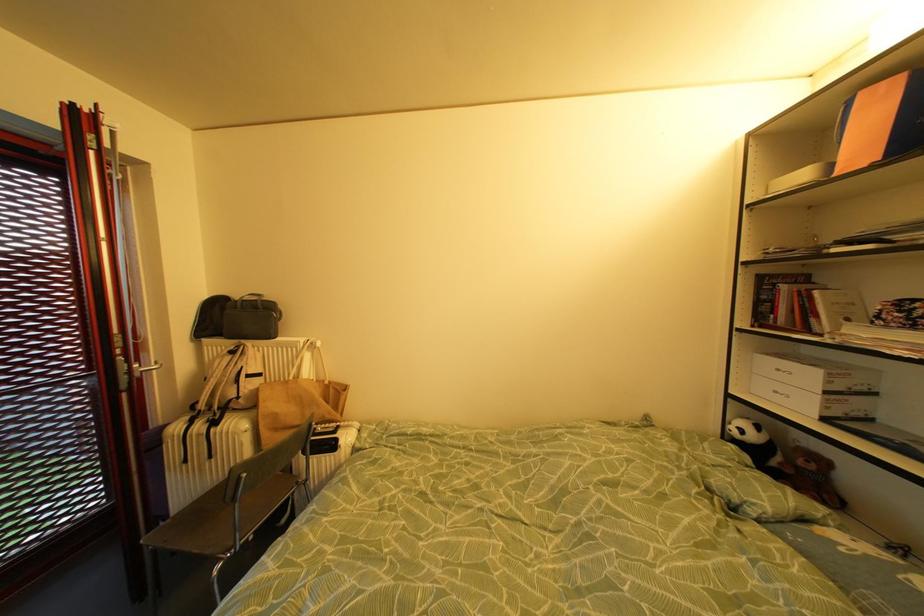
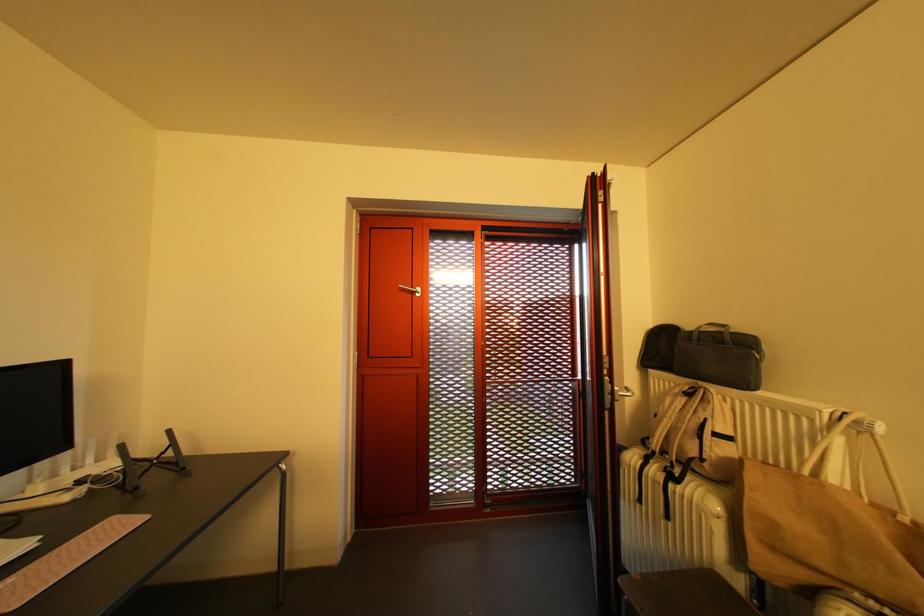
Question: The camera is either moving clockwise (left) or counter-clockwise (right) around the object. The first image is from the beginning of the video and the second image is from the end. Is the camera moving left or right when shooting the video?

Choices:
 (A) Left
 (B) Right

Answer: (B)